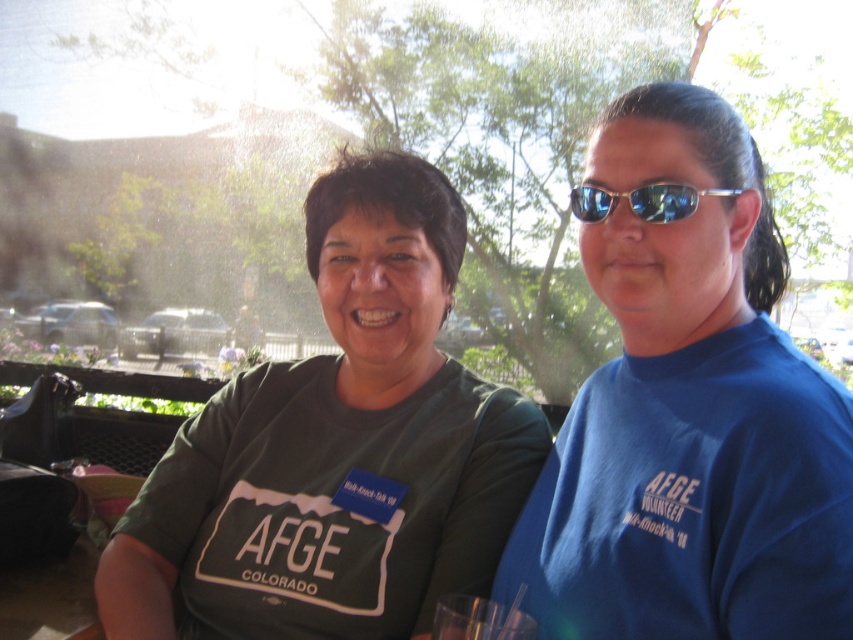
Between point (408, 173) and point (679, 204), which one is positioned in front?

Point (679, 204) is in front.

Is green matte shirt at center bigger than sunglasses at right?

Yes, green matte shirt at center is bigger than sunglasses at right.

Which is behind, point (546, 435) or point (695, 202)?

The point (546, 435) is more distant.

Find the location of a particular element. green matte shirt at center is located at coordinates (337, 449).

Can you confirm if blue t-shirt at center is positioned to the right of sunglasses at right?

Yes, blue t-shirt at center is to the right of sunglasses at right.

Is blue t-shirt at center below sunglasses at right?

Yes.

I want to click on blue t-shirt at center, so click(x=689, y=416).

Is the position of blue t-shirt at center more distant than that of green matte shirt at center?

No, blue t-shirt at center is in front of green matte shirt at center.

Who is taller, blue t-shirt at center or green matte shirt at center?

With more height is green matte shirt at center.

Between point (711, 307) and point (401, 472), which one is positioned in front?

Point (711, 307)

Find the location of a particular element. blue t-shirt at center is located at coordinates (689, 416).